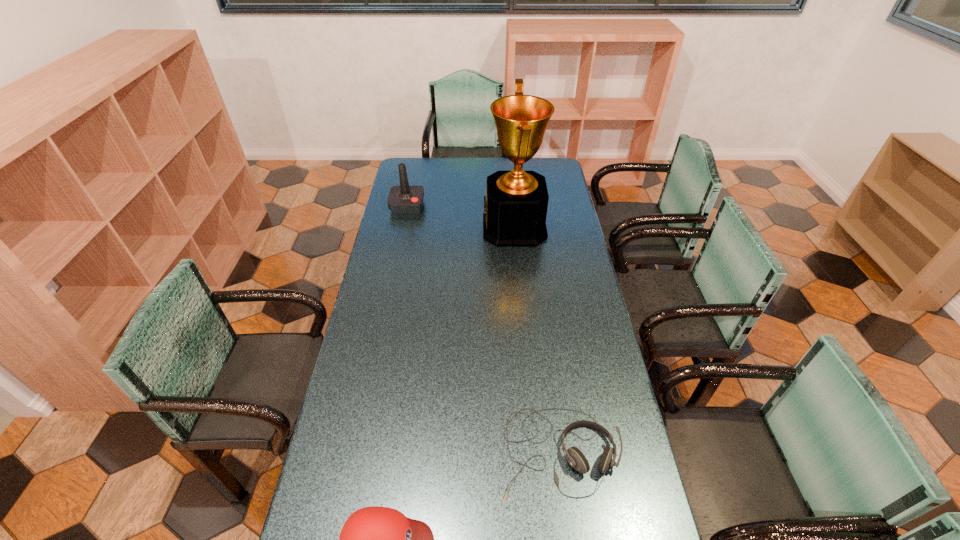
Where is `the tallest object`? This screenshot has height=540, width=960. the tallest object is located at coordinates (515, 207).

Locate an element on the screen. joystick is located at coordinates (403, 199).

Image resolution: width=960 pixels, height=540 pixels. Find the location of `the second nearest object`. the second nearest object is located at coordinates (576, 459).

This screenshot has height=540, width=960. I want to click on vacant space located 0.160m on the front of the trophy cup with the label, so click(448, 227).

Where is `vacant space located 0.360m on the front of the trophy cup with the label`? The height and width of the screenshot is (540, 960). vacant space located 0.360m on the front of the trophy cup with the label is located at coordinates (405, 227).

Image resolution: width=960 pixels, height=540 pixels. I want to click on free space located on the front of the trophy cup with the label, so click(x=453, y=227).

Where is `vacant area situated on the right of the joystick`? The image size is (960, 540). vacant area situated on the right of the joystick is located at coordinates (441, 206).

Identify the location of object that is at the left edge. This screenshot has height=540, width=960. (403, 199).

Identify the location of trophy cup that is at the right edge. (515, 207).

I want to click on headset that is at the right edge, so click(576, 459).